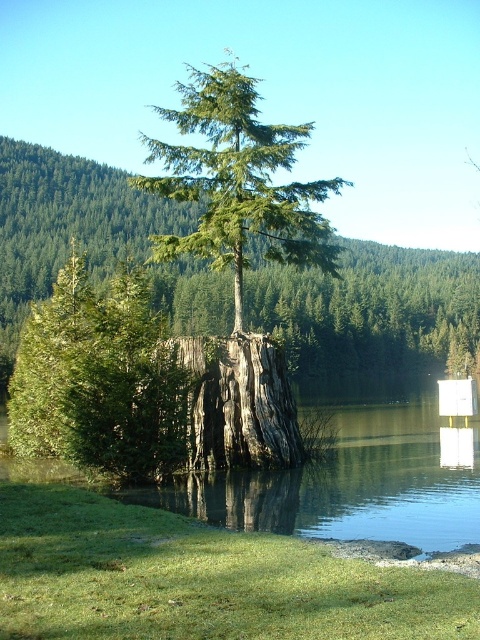
Does clear water at center come in front of dark gray rough tree trunk at center?

That is True.

Describe the element at coordinates (350, 476) in the screenshot. I see `clear water at center` at that location.

The image size is (480, 640). What are the coordinates of `clear water at center` in the screenshot? It's located at (350, 476).

Between green rough bark tree at center and clear water at center, which one has less height?

Standing shorter between the two is clear water at center.

Between point (239, 148) and point (137, 502), which one is positioned behind?

Positioned behind is point (239, 148).

Between point (263, 179) and point (207, 483), which one is positioned in front?

Point (207, 483) is in front.

The height and width of the screenshot is (640, 480). In order to click on green rough bark tree at center in this screenshot , I will do `click(239, 256)`.

Looking at this image, who is lower down, green rough bark tree at center or dark gray rough tree trunk at center?

Positioned lower is dark gray rough tree trunk at center.

Is green rough bark tree at center smaller than dark gray rough tree trunk at center?

No.

I want to click on green rough bark tree at center, so click(x=239, y=256).